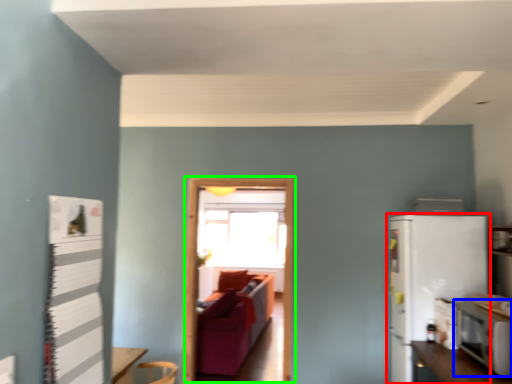
Question: Which object is the farthest from refrigerator (highlighted by a red box)? Choose among these: appliance (highlighted by a blue box) or glass door (highlighted by a green box).

Choices:
 (A) appliance
 (B) glass door

Answer: (B)